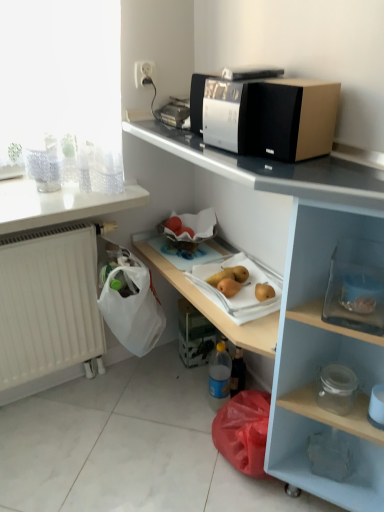
Locate an element on the screen. The width and height of the screenshot is (384, 512). vacant space in front of white matte radiator at lower left is located at coordinates (64, 438).